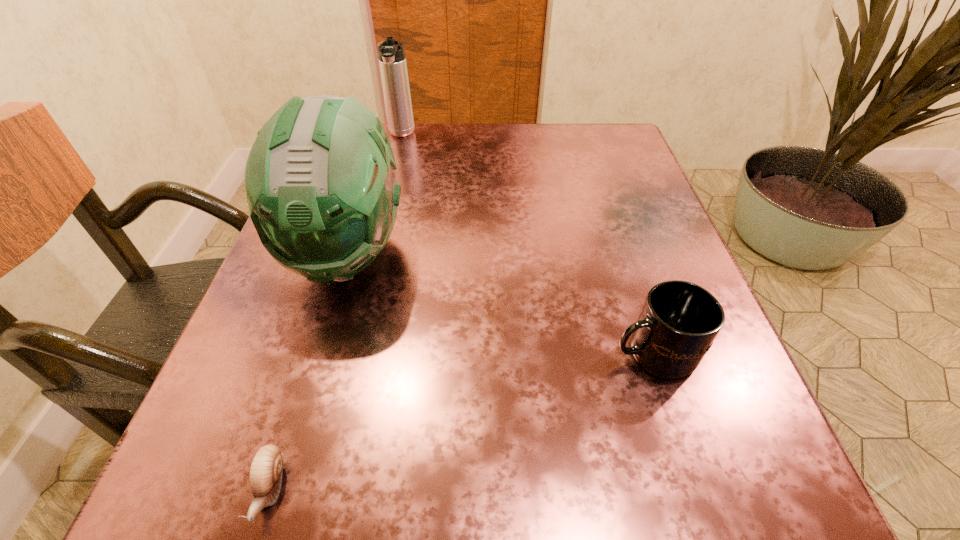
I want to click on the second farthest object, so click(320, 183).

This screenshot has height=540, width=960. Identify the location of the tallest object. (320, 183).

Identify the location of the third shortest object. (392, 60).

This screenshot has height=540, width=960. In order to click on thermos bottle in this screenshot , I will do `click(392, 60)`.

At what (x,y) coordinates should I click in order to perform the action: click on the rightmost object. Please return your answer as a coordinate pair (x, y). The height and width of the screenshot is (540, 960). Looking at the image, I should click on (679, 321).

You are a GUI agent. You are given a task and a screenshot of the screen. Output one action in this format:
    pyautogui.click(x=<x>, y=<y>)
    Task: Click on the mug
    The height and width of the screenshot is (540, 960).
    Given the screenshot: What is the action you would take?
    pyautogui.click(x=679, y=321)

Locate an element on the screen. Image resolution: width=960 pixels, height=540 pixels. escargot is located at coordinates (266, 468).

The image size is (960, 540). Identify the location of the shortest object. (266, 468).

This screenshot has height=540, width=960. I want to click on blank space located on the visor of the football helmet, so click(x=293, y=430).

This screenshot has width=960, height=540. Identify the location of vacant space positioned on the handle side of the third shortest object. (369, 265).